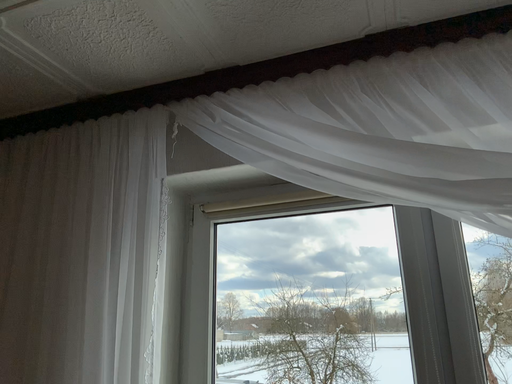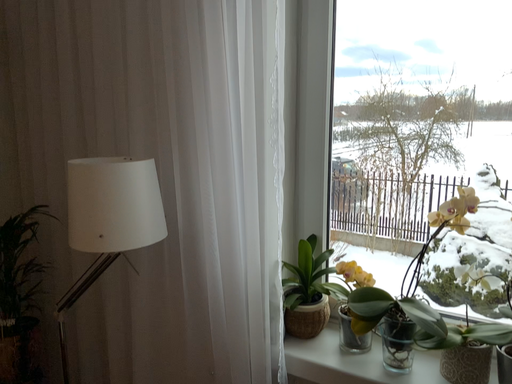
Question: How did the camera likely rotate when shooting the video?

Choices:
 (A) rotated upward
 (B) rotated downward

Answer: (B)